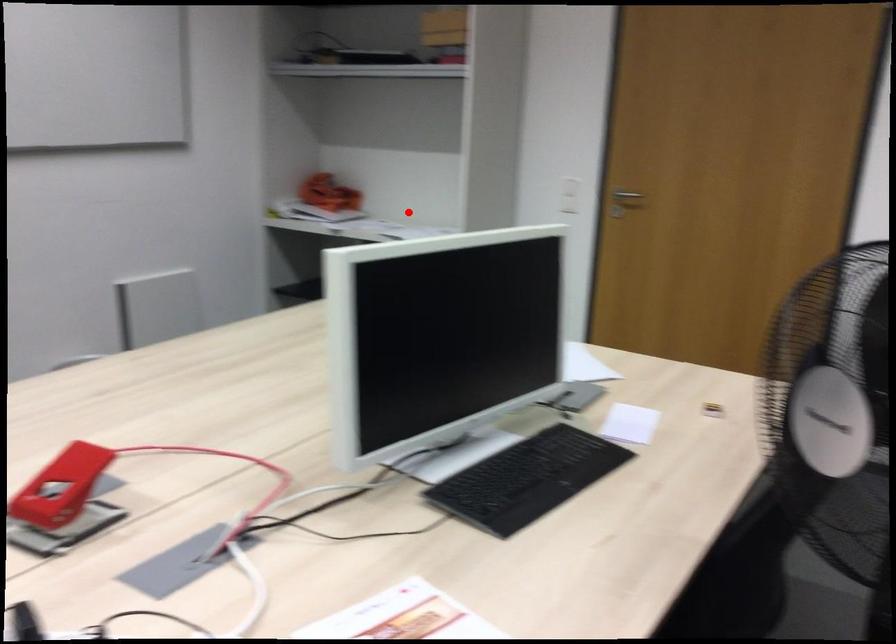
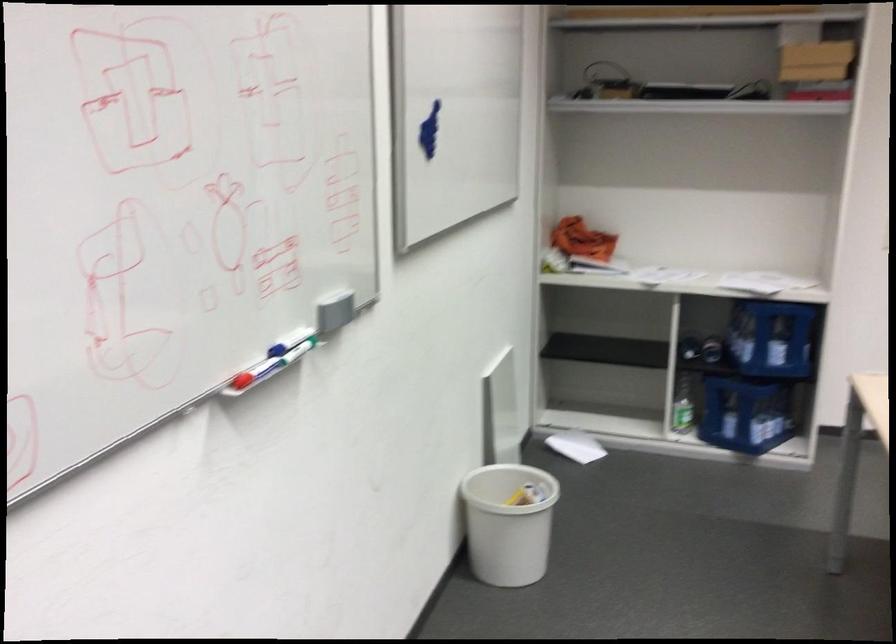
Question: I am providing you with two images of the same scene from different viewpoints. Given a red point in image1, look at the same physical point in image2. Is it:

Choices:
 (A) Closer to the viewpoint
 (B) Farther from the viewpoint

Answer: (A)